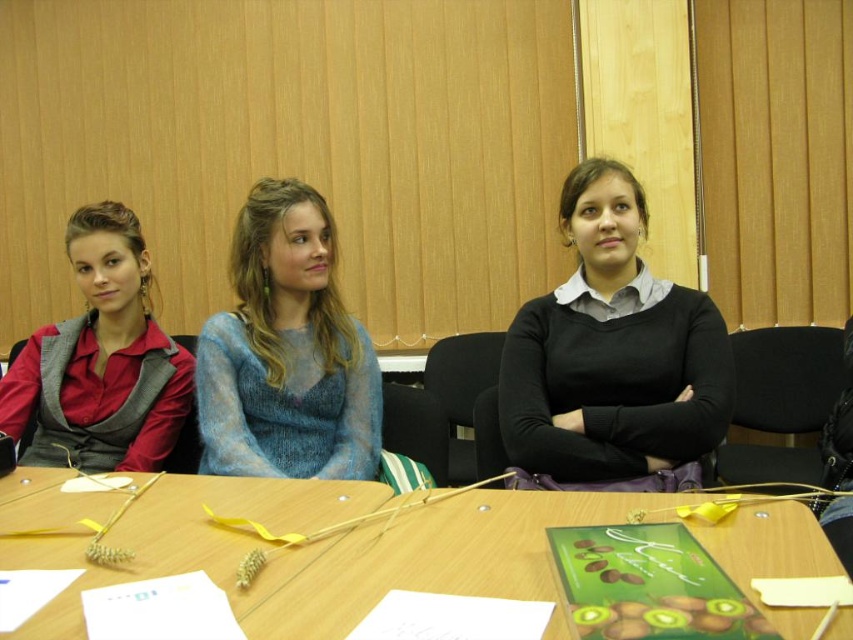
You are a person sitting at the wooden table at center. You want to hand a document to the person wearing the matte red shirt at left. Can you reach them from your current position?

The wooden table at center is positioned under matte red shirt at left, so the table is between you and the person wearing the matte red shirt at left. This means you cannot directly reach them from your current position.

Based on the photo, you are sitting at the wooden table in the meeting room. You see two points marked on the table. The first point is at coordinate point (505, 445) and the second point is at coordinate point (357, 410). Which point is closer to you?

Point (505, 445) is in front of point (357, 410), so the first point is closer to you.

You are standing in the room and want to reach the point at coordinates (814, 621). If your arm length is 28 inches, can you reach it without moving your feet?

The point at coordinates (814, 621) is 34.80 inches away from you. Since your arm length is 28 inches, you cannot reach it without moving your feet.